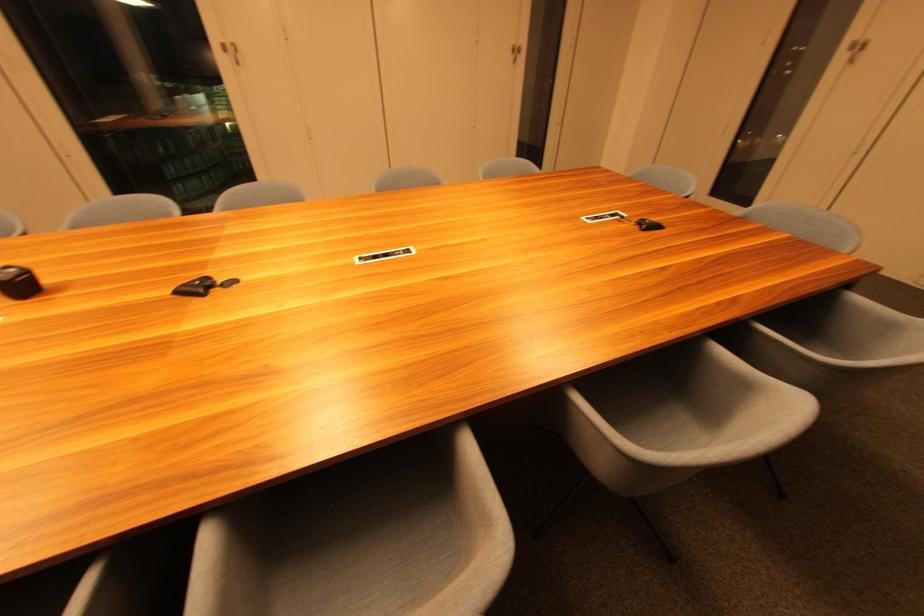
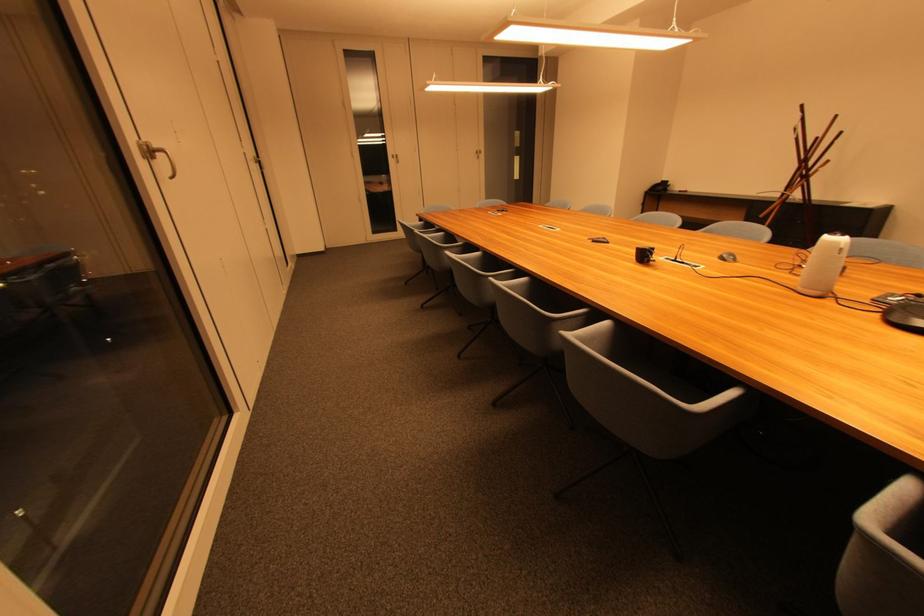
In the second image, find the point that corresponds to point 515,51 in the first image.

(259, 163)